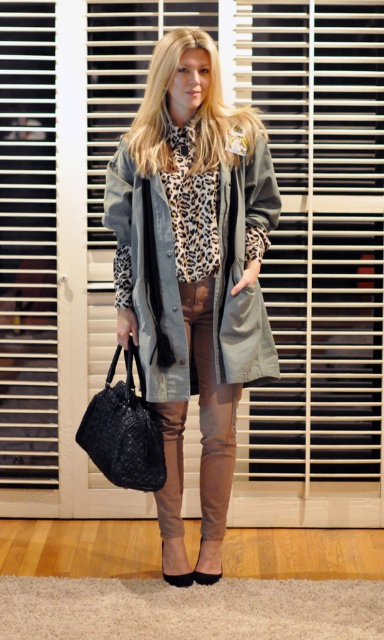
Does black woven handbag at lower left appear on the left side of leopard print fabric scarf at center?

Indeed, black woven handbag at lower left is positioned on the left side of leopard print fabric scarf at center.

Does black woven handbag at lower left have a greater width compared to leopard print fabric scarf at center?

Correct, the width of black woven handbag at lower left exceeds that of leopard print fabric scarf at center.

Who is more forward, (x=112, y=412) or (x=211, y=204)?

Point (x=211, y=204) is more forward.

Where is `black woven handbag at lower left`? This screenshot has width=384, height=640. black woven handbag at lower left is located at coordinates coord(124,429).

Which of these two, matte olive green trench coat at center or leopard print fabric scarf at center, stands taller?

matte olive green trench coat at center is taller.

Is matte olive green trench coat at center wider than leopard print fabric scarf at center?

Yes.

Image resolution: width=384 pixels, height=640 pixels. Find the location of `matte olive green trench coat at center`. matte olive green trench coat at center is located at coordinates (241, 272).

Which is below, matte olive green trench coat at center or black woven handbag at lower left?

black woven handbag at lower left is lower down.

Is matte olive green trench coat at center below black woven handbag at lower left?

Incorrect, matte olive green trench coat at center is not positioned below black woven handbag at lower left.

Which is in front, point (178, 392) or point (91, 410)?

Positioned in front is point (178, 392).

The image size is (384, 640). Identify the location of matte olive green trench coat at center. (241, 272).